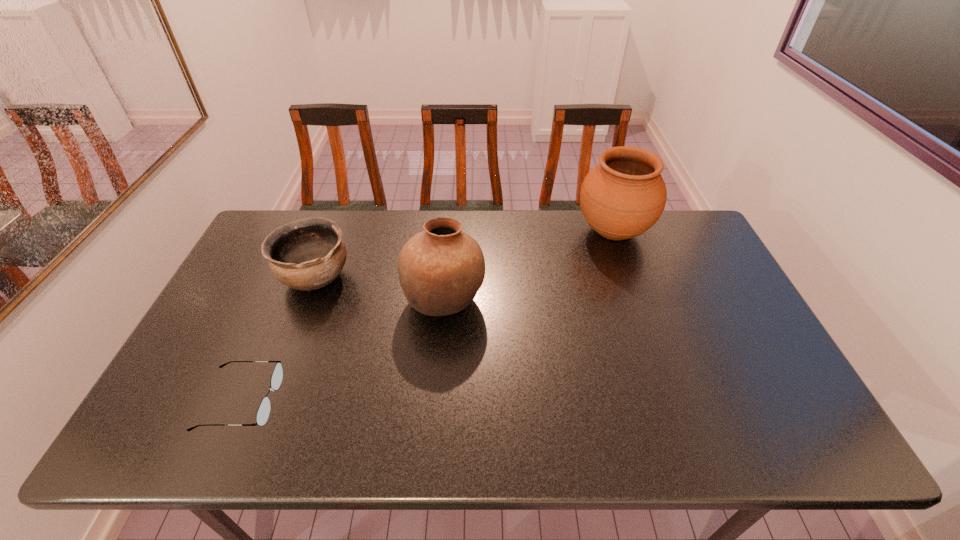
At what (x,y) coordinates should I click in order to perform the action: click on the rightmost object. Please return your answer as a coordinate pair (x, y). Looking at the image, I should click on (623, 196).

Locate an element on the screen. This screenshot has height=540, width=960. the second object from right to left is located at coordinates (441, 269).

Image resolution: width=960 pixels, height=540 pixels. What are the coordinates of `the third tallest object` in the screenshot? It's located at (307, 254).

This screenshot has width=960, height=540. In order to click on the leftmost pottery in this screenshot , I will do `click(307, 254)`.

Identify the location of spectacles. (263, 412).

Locate an element on the screen. the nearest object is located at coordinates (263, 412).

Identify the location of vacant space located on the front of the rightmost pottery. (635, 293).

Where is `vacant area situated on the left of the third object from left to right`? This screenshot has height=540, width=960. vacant area situated on the left of the third object from left to right is located at coordinates (342, 300).

Where is `vacant region located 0.230m on the back of the third tallest object`? The width and height of the screenshot is (960, 540). vacant region located 0.230m on the back of the third tallest object is located at coordinates (341, 212).

Where is `free space located 0.350m on the lenses of the shortest object`? free space located 0.350m on the lenses of the shortest object is located at coordinates (422, 401).